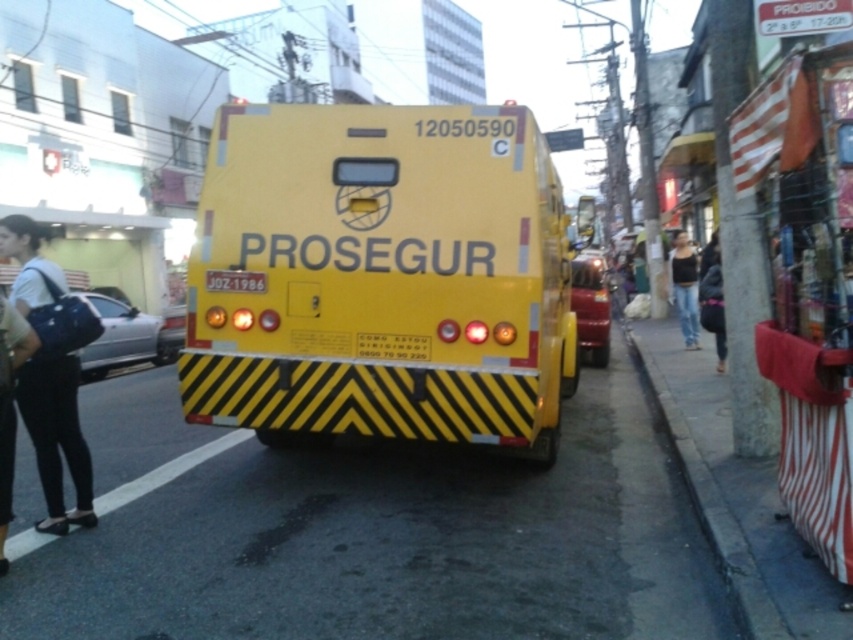
You are a delivery driver who needs to park your vehicle behind the yellow matte truck at center without blocking the yellow reflective license plate at center. Based on their positions, which side of the truck should you park on?

The yellow matte truck at center is to the right of the yellow reflective license plate at center, so you should park on the left side of the yellow matte truck at center to avoid blocking the license plate.

You are a delivery person who needs to deliver a package to the Prosegur security van. The van has a yellow matte truck at center and a yellow reflective license plate at center. According to the image, which object is covering the other one?

The yellow matte truck at center is positioned over the yellow reflective license plate at center, so the truck is covering the license plate.

You are a delivery driver who needs to park your vehicle in a parking spot located at coordinates 0.433, 0.447. Can you safely park your car without blocking the yellow matte truck at center?

The yellow matte truck at center is exactly located at the coordinates (380, 276), so parking there would block it. Choose another spot.